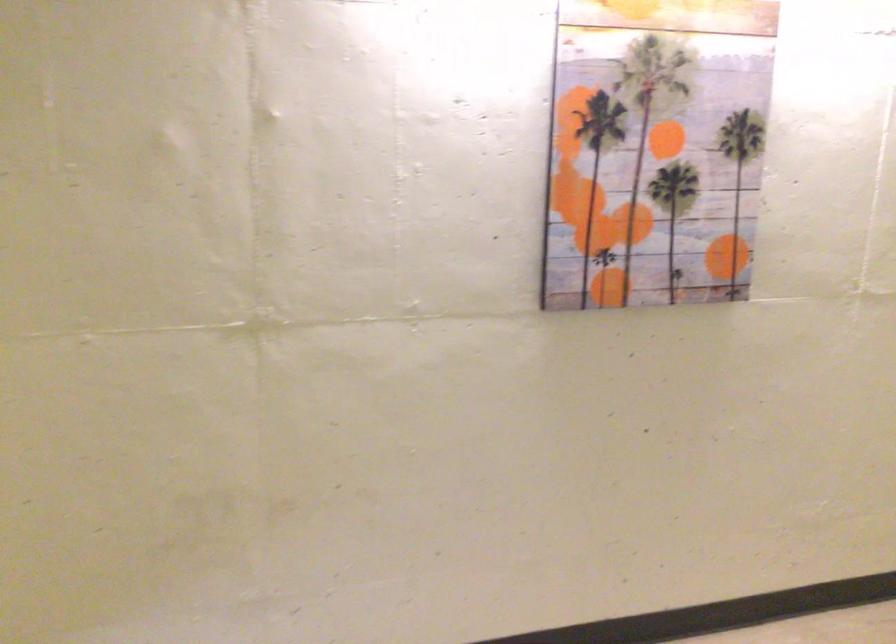
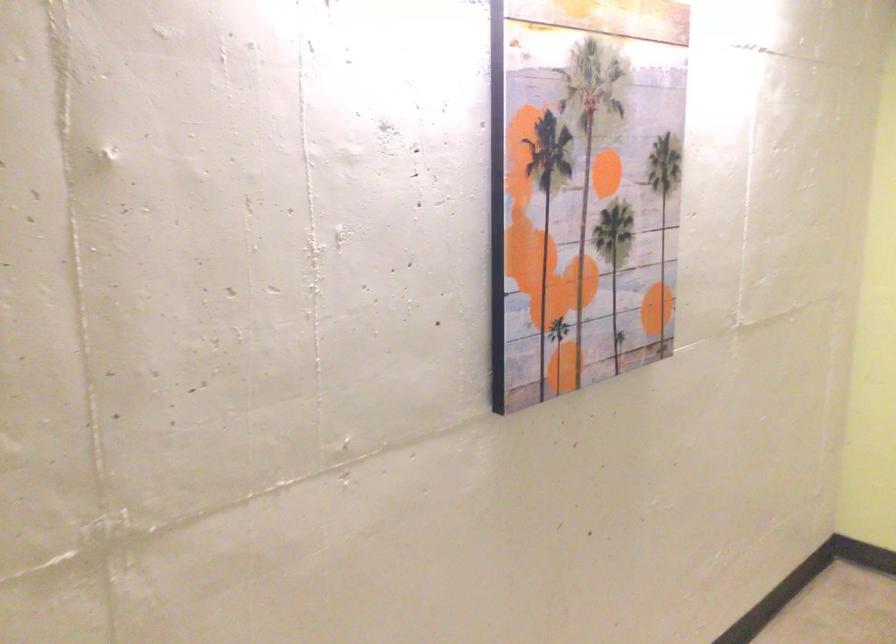
Which direction would the cameraman need to move to produce the second image?

The movement direction of the cameraman is left, forward.